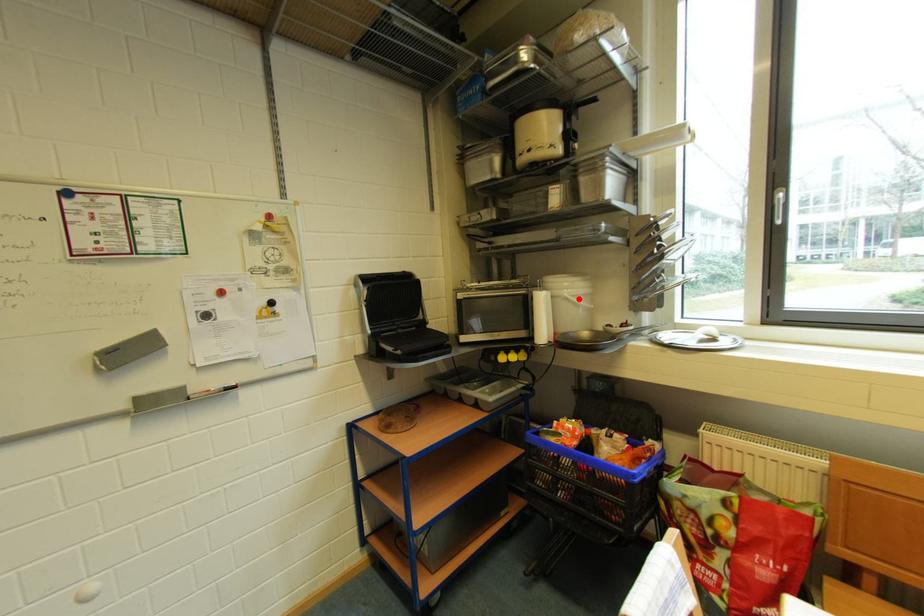
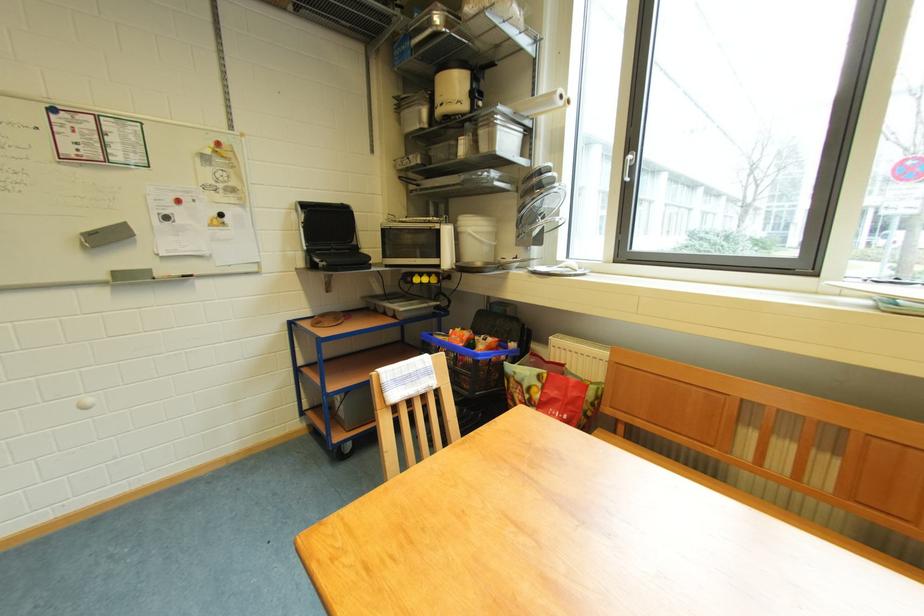
The point at the highlighted location is marked in the first image. Where is the corresponding point in the second image?

(481, 235)